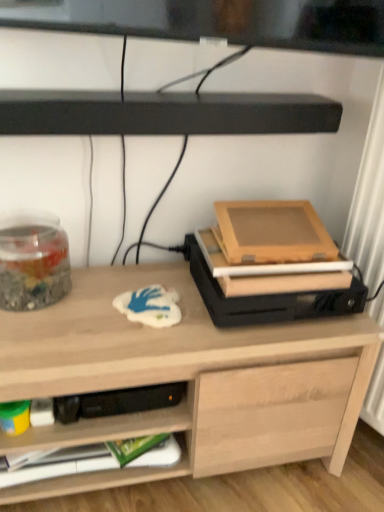
Question: In terms of width, does black matte soundbar at upper center look wider or thinner when compared to transparent glass jar at left?

Choices:
 (A) wide
 (B) thin

Answer: (B)

Question: Is black matte soundbar at upper center bigger or smaller than transparent glass jar at left?

Choices:
 (A) small
 (B) big

Answer: (B)

Question: Which of these objects is positioned farthest from the transparent glass jar at left?

Choices:
 (A) black matte soundbar at upper center
 (B) green matte paperback book at lower left
 (C) light wood desk at center

Answer: (B)

Question: Estimate the real-world distances between objects in this image. Which object is farther from the transparent glass jar at left?

Choices:
 (A) black matte soundbar at upper center
 (B) green matte paperback book at lower left
 (C) light wood desk at center

Answer: (B)